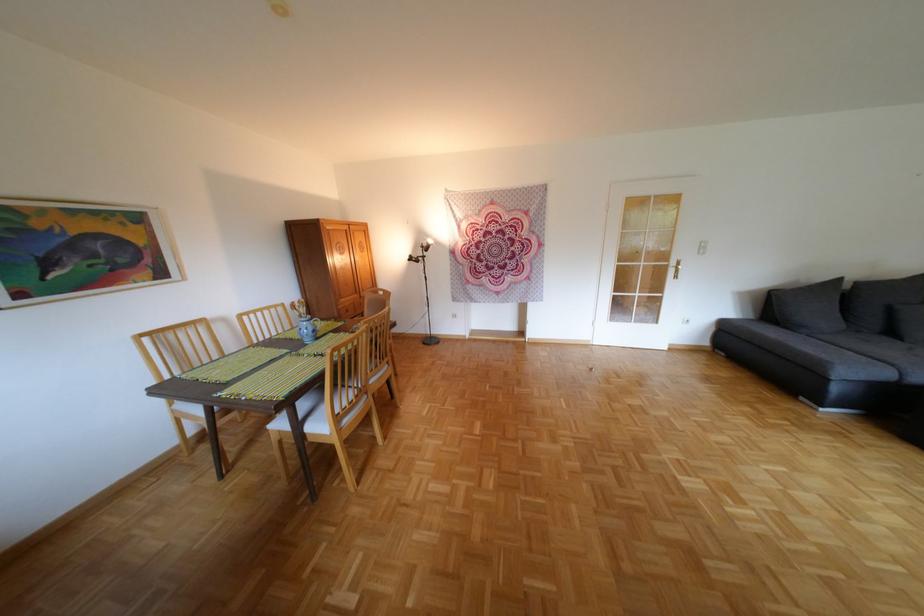
Find where to sit the white chair seat. Please return your answer as a coordinate pair (x, y).

(312, 414)